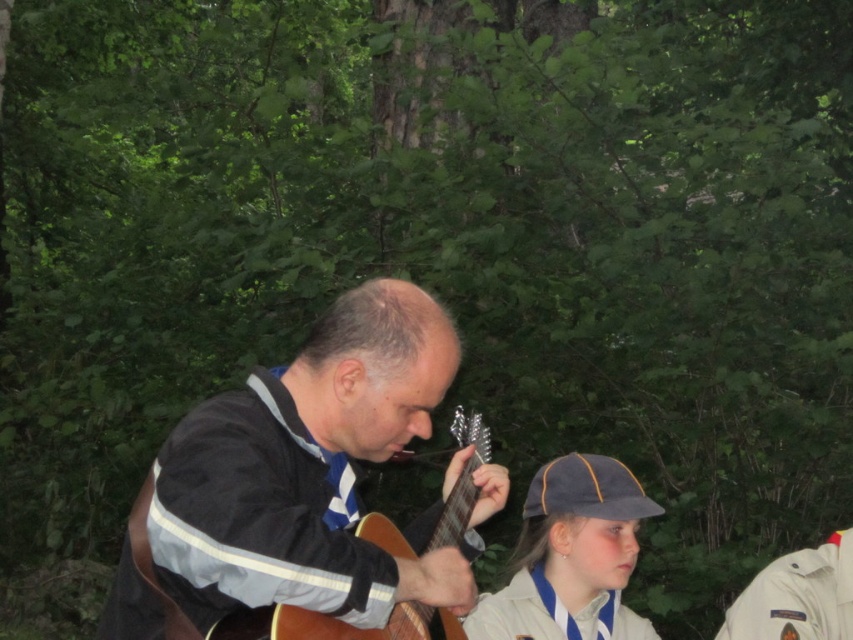
You are a photographer trying to capture the man playing the acoustic guitar and the children in the scene. You want to ensure that the black fabric jacket at center is visible in your photo. Where should you position the camera relative to the point marked at coordinates point (308, 470)?

The point (308, 470) marks the location of the black fabric jacket at center. To include it in the photo, position the camera so that the jacket is within the frame at that coordinate.

You are a photographer standing at the center of the scene. You want to take a photo of the black fabric jacket at center. Where should you aim your camera to capture it in the frame?

You should aim your camera at point [308,470] to capture the black fabric jacket at center in the frame.

You are a photographer trying to capture a candid shot of the black fabric jacket at center and the white fabric uniform at lower center. Since you want to ensure both are visible in the frame, can you determine which one is on the left side?

The black fabric jacket at center is positioned on the left side of white fabric uniform at lower center, so the black fabric jacket at center will be on the left in the photo.